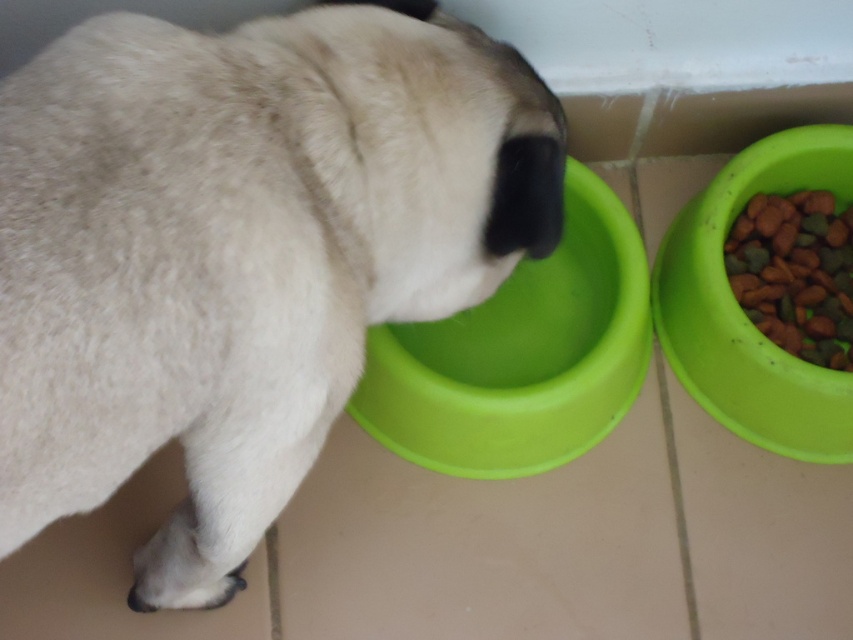
You are a dog owner who wants to ensure your pet has enough food. You see the green plastic bowl at right and the green matte kibble at right. Which one is located lower?

The green plastic bowl at right is below green matte kibble at right, so the bowl is lower than the kibble.

You are a dog owner who wants to place a new toy between the white matte dog at center and the green plastic bowl at lower left. Based on their positions, where should you place the toy so it is between them?

The white matte dog at center is positioned on the left side of the green plastic bowl at lower left, so to place the toy between them, you should put it to the right of the white matte dog at center and to the left of the green plastic bowl at lower left.

You are a dog owner who wants to place a new treat bowl for your dog. The existing green plastic bowl at right is already in use. Where should you place the new bowl to avoid blocking the dog from reaching its current bowl?

Place the new treat bowl away from the location of the green plastic bowl at right at point (x=741, y=308) to avoid blocking the dog from reaching it.